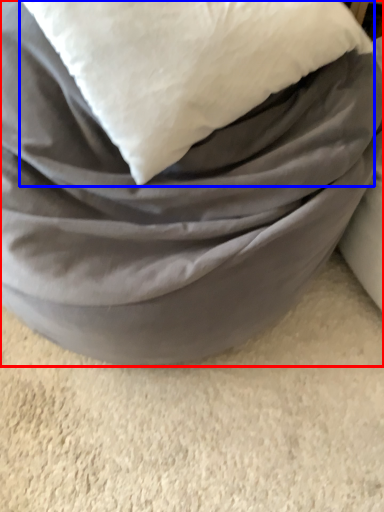
Question: Which of the following is the farthest to the observer, furniture (highlighted by a red box) or pillow (highlighted by a blue box)?

Choices:
 (A) furniture
 (B) pillow

Answer: (B)